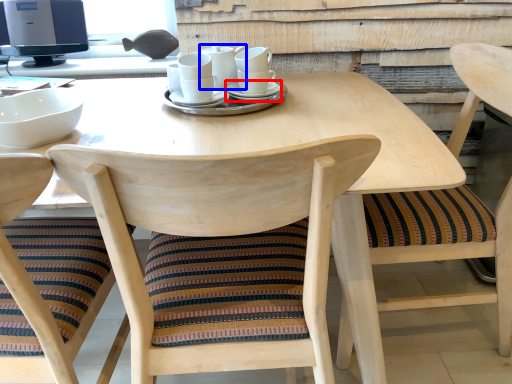
Question: Which object appears closest to the camera in this image, saucer (highlighted by a red box) or tableware (highlighted by a blue box)?

Choices:
 (A) saucer
 (B) tableware

Answer: (A)